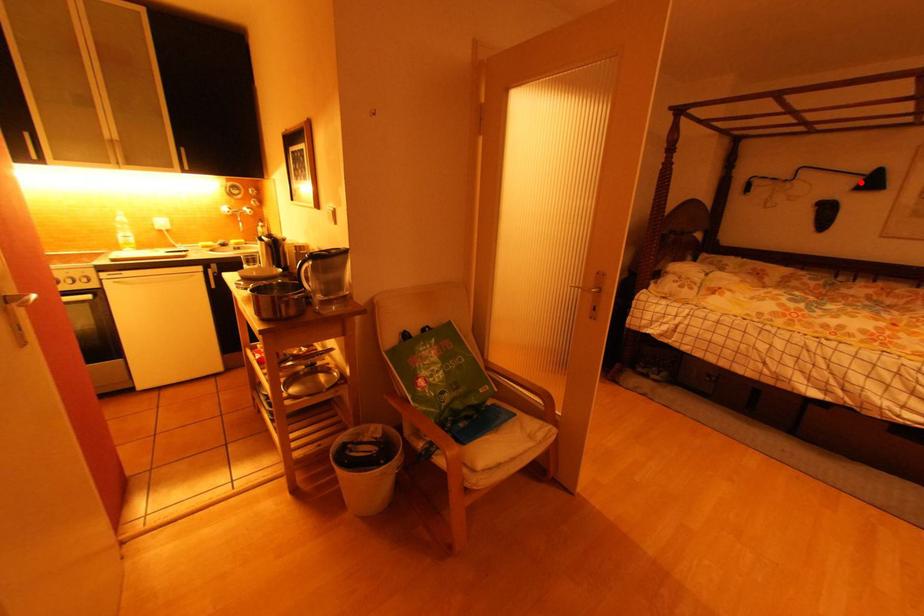
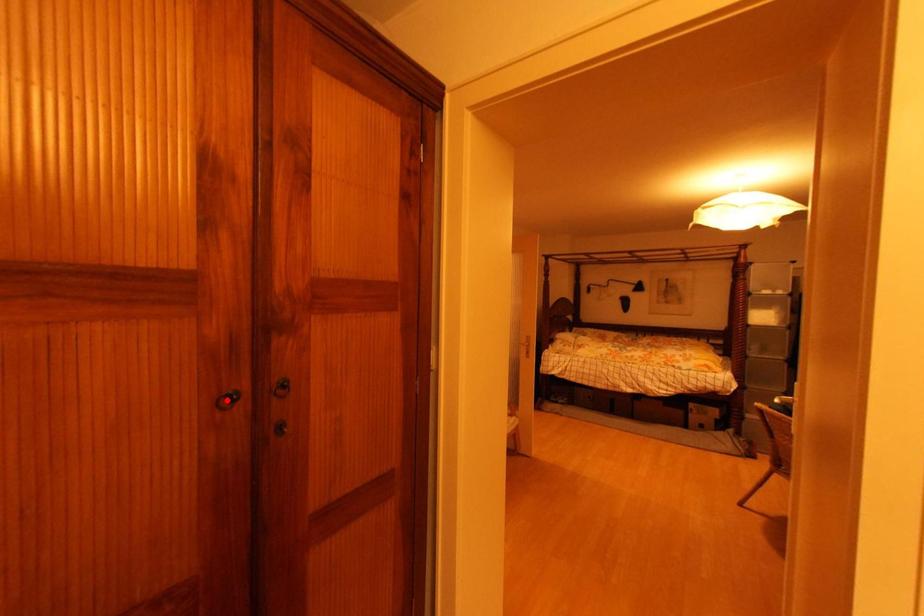
I am providing you with two images of the same scene from different viewpoints. A red point is marked on the first image and another point is marked on the second image. Is the marked point in image1 the same physical position as the marked point in image2?

No